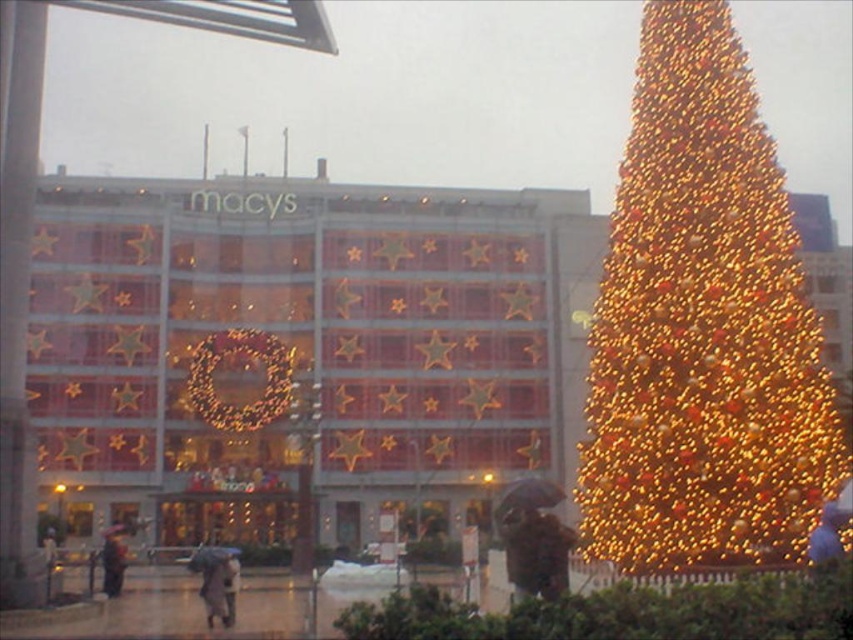
Question: Can you confirm if blue fabric umbrella at lower right is positioned to the right of dark gray coat at lower left?

Choices:
 (A) no
 (B) yes

Answer: (B)

Question: Which point is closer to the camera?

Choices:
 (A) (695, 84)
 (B) (820, 531)

Answer: (B)

Question: Does blue fabric umbrella at lower right have a smaller size compared to dark gray coat at lower left?

Choices:
 (A) no
 (B) yes

Answer: (B)

Question: Estimate the real-world distances between objects in this image. Which object is farther from the dark gray coat at lower left?

Choices:
 (A) illuminated gold christmas tree at right
 (B) blue fabric umbrella at lower right

Answer: (B)

Question: Does illuminated gold christmas tree at right have a lesser width compared to dark gray coat at lower left?

Choices:
 (A) yes
 (B) no

Answer: (B)

Question: Which point is closer to the camera?

Choices:
 (A) (816, 557)
 (B) (120, 552)

Answer: (A)